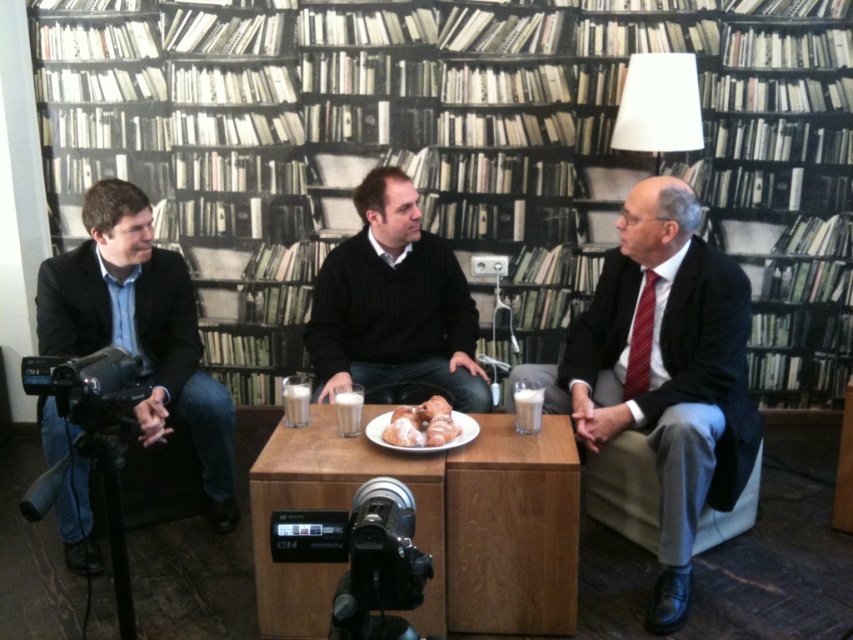
Question: Does blue denim jeans at left appear on the right side of powdery white croissant at center?

Choices:
 (A) no
 (B) yes

Answer: (A)

Question: Which point is closer to the camera?

Choices:
 (A) (677, 472)
 (B) (131, 227)
 (C) (129, 408)

Answer: (C)

Question: Does wooden bookcase at upper center appear on the right side of black plastic video camera at lower left?

Choices:
 (A) yes
 (B) no

Answer: (A)

Question: Is the position of wooden bookcase at upper center less distant than that of black plastic video camera at lower left?

Choices:
 (A) yes
 (B) no

Answer: (B)

Question: Which object is positioned closest to the blue denim jeans at left?

Choices:
 (A) matte black suit at center
 (B) powdery white croissant at center

Answer: (B)

Question: Which point is farther to the camera?

Choices:
 (A) (207, 406)
 (B) (489, 524)
 (C) (384, 22)
 (D) (469, 317)

Answer: (C)